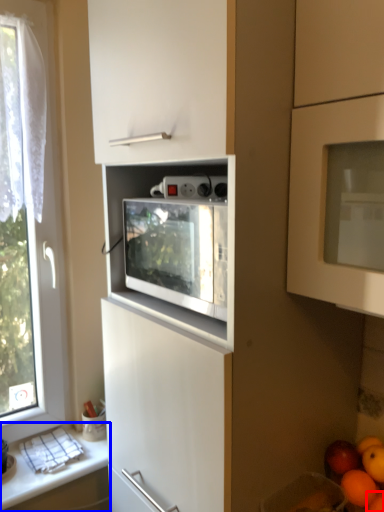
Question: Which of the following is the closest to the observer, orange (highlighted by a red box) or countertop (highlighted by a blue box)?

Choices:
 (A) orange
 (B) countertop

Answer: (A)